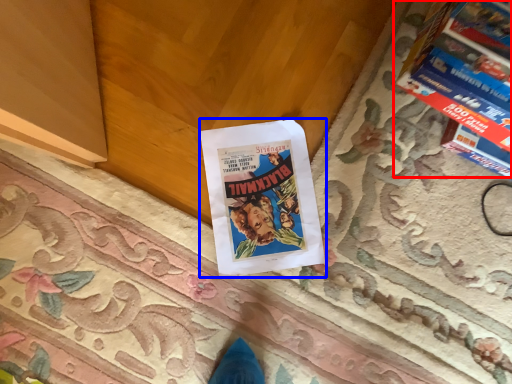
Question: Which of the following is the closest to the observer, magazine (highlighted by a red box) or book (highlighted by a blue box)?

Choices:
 (A) magazine
 (B) book

Answer: (A)